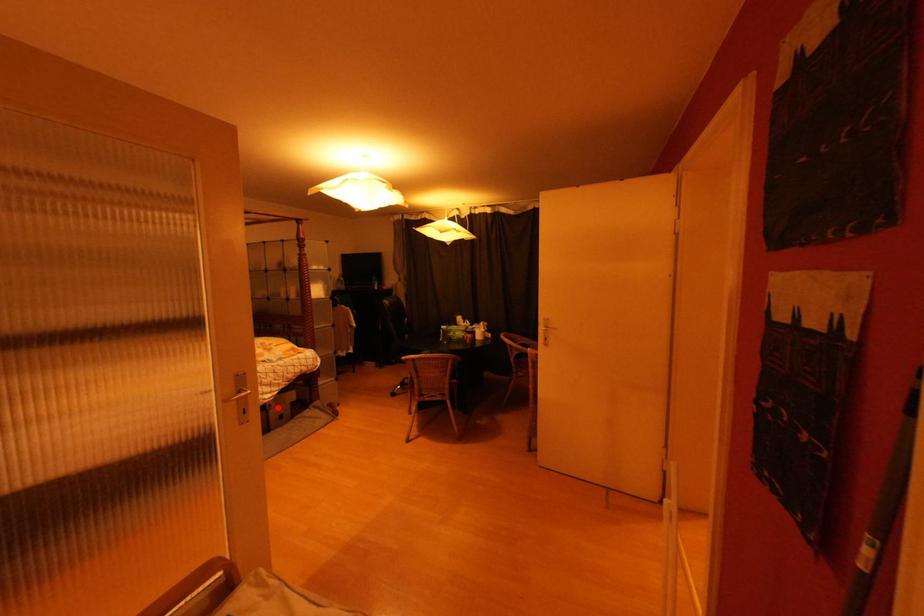
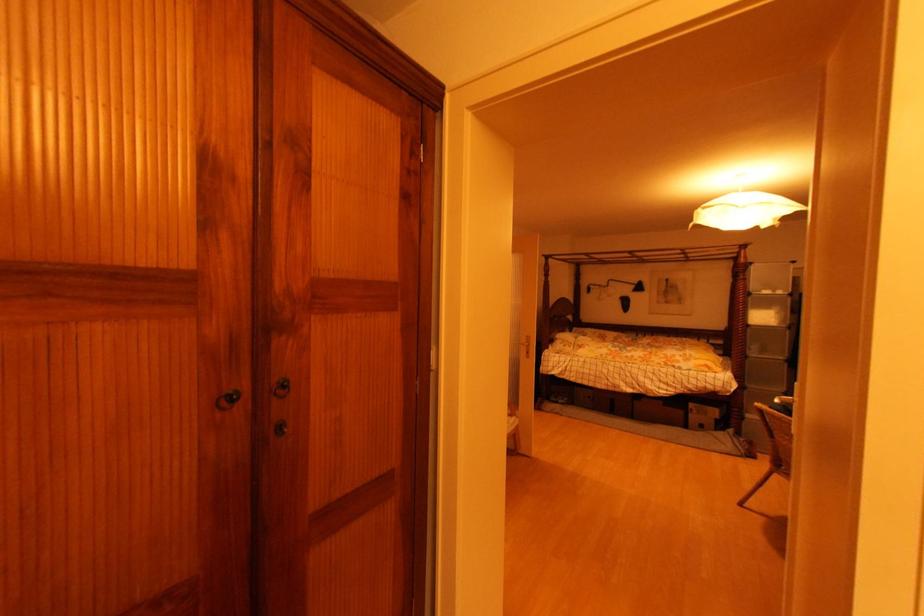
The point at the highlighted location is marked in the first image. Where is the corresponding point in the second image?

(699, 413)